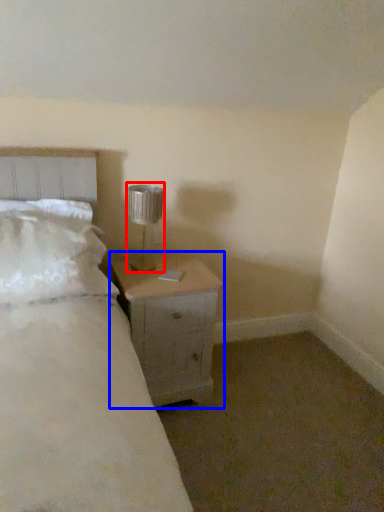
Question: Which point is further to the camera, lamp (highlighted by a red box) or nightstand (highlighted by a blue box)?

Choices:
 (A) lamp
 (B) nightstand

Answer: (A)